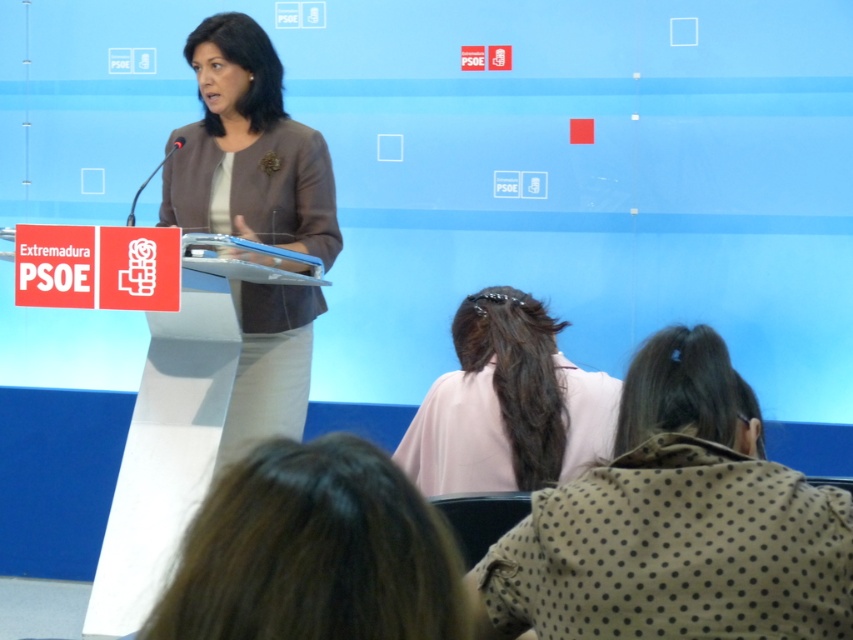
You are a photographer at the event and need to capture a closeup of both the brown hair at lower center and the matte brown blazer at center. Given that your camera can only focus on objects within a 5 feet range, will you be able to capture both in a single shot?

The brown hair at lower center and the matte brown blazer at center are 6.43 feet apart, which exceeds the camera focus range of 5 feet. Therefore, you cannot capture both in a single shot.

From the picture: You are a photographer at the event and need to adjust your camera settings to focus on both the brown dotted fabric at lower center and the matte brown blazer at center. Given their distance apart, can you set a single focus point that captures both clearly?

The brown dotted fabric at lower center is 4.98 feet from the matte brown blazer at center. Since the distance between them is relatively small, a single focus point can likely capture both clearly by focusing on the midpoint between them.

You are a photographer at the event. You need to capture a closeup of the brown dotted fabric at lower center and the light pink fabric at center. Which fabric will require a wider angle to capture its full width in the photo?

The brown dotted fabric at lower center has a greater width than the light pink fabric at center, so it will require a wider angle to capture its full width in the photo.